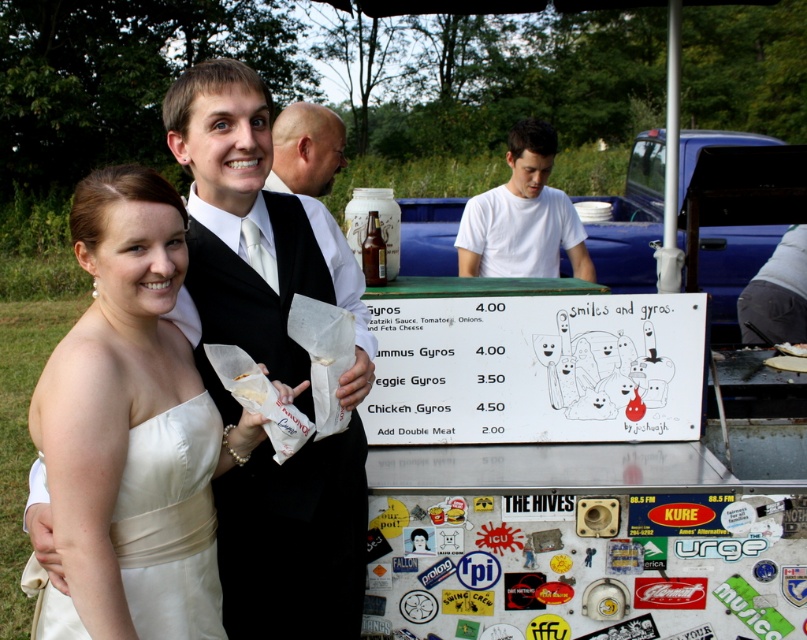
Who is more distant from viewer, (x=115, y=548) or (x=337, y=157)?

The point (x=337, y=157) is behind.

Between point (210, 624) and point (295, 138), which one is positioned in front?

Point (210, 624) is in front.

Locate an element on the screen. The width and height of the screenshot is (807, 640). satin white dress at left is located at coordinates (170, 524).

Can you confirm if white matte shirt at center is positioned above smooth bald head at center?

Incorrect, white matte shirt at center is not positioned above smooth bald head at center.

Can you confirm if white matte shirt at center is positioned below smooth bald head at center?

Indeed, white matte shirt at center is positioned under smooth bald head at center.

Is point (534, 269) less distant than point (274, 120)?

No, (534, 269) is further to viewer.

The width and height of the screenshot is (807, 640). I want to click on white matte shirt at center, so click(x=521, y=216).

Who is lower down, satin white dress at left or white matte shirt at center?

Positioned lower is satin white dress at left.

Which is in front, point (138, 602) or point (517, 179)?

Point (138, 602) is in front.

In order to click on satin white dress at left in this screenshot , I will do `click(170, 524)`.